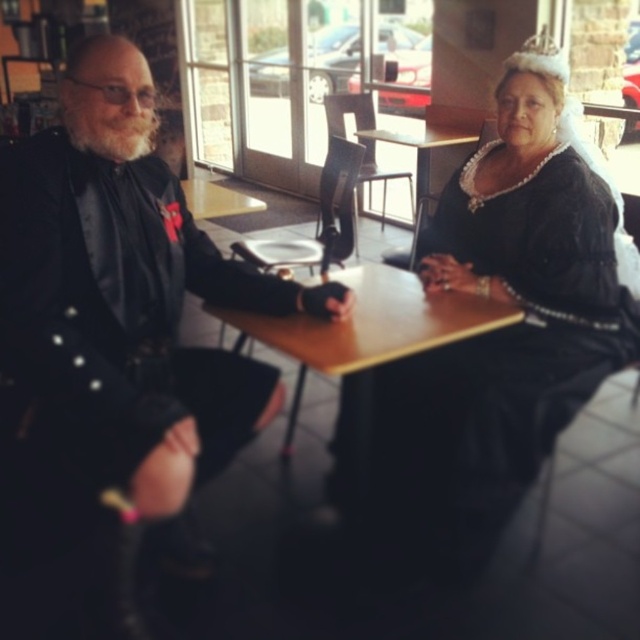
You are a photographer setting up for a portrait. You want to ensure both the black satin dress at center and the wooden table at center are in focus. Which object should you focus on first to achieve this?

You should focus on the wooden table at center first because it is closer to the camera than the black satin dress at center, allowing both to be in focus when using depth of field techniques.

You are a photographer setting up for a portrait. You need to position a spotlight so that it illuminates both the black satin dress at center and the wooden table at center without casting shadows on the background. Given their positions, where should you place the spotlight relative to the two objects?

The black satin dress at center is located below the wooden table at center, so placing the spotlight above the wooden table at center would illuminate both objects while keeping shadows away from the background.

You are a photographer setting up for a portrait session in the dining area. You need to ensure that the black satin suit at left and the wooden table at center are both in frame. Considering their sizes, which object will appear larger in the photo?

The black satin suit at left will appear much larger in the photo than the wooden table at center because it is much taller as the table.